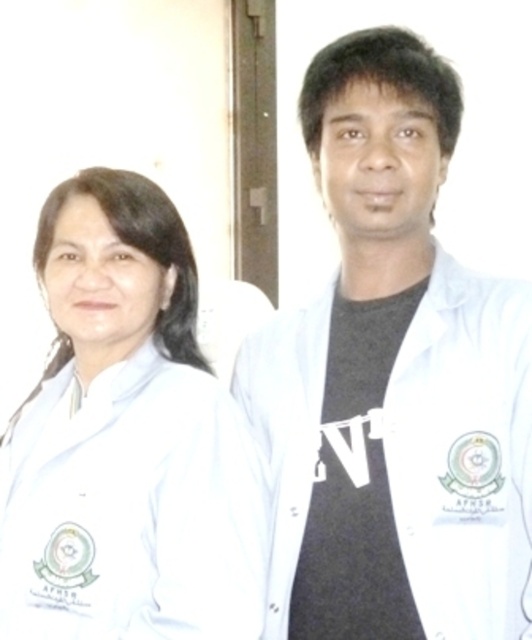
What do you see at coordinates (127, 440) in the screenshot? I see `white matte lab coat at left` at bounding box center [127, 440].

Who is more forward, (147,400) or (477,410)?

Point (477,410) is in front.

Is point (70, 355) closer to viewer compared to point (289, 541)?

That is False.

Locate an element on the screen. The width and height of the screenshot is (532, 640). white matte lab coat at left is located at coordinates (127, 440).